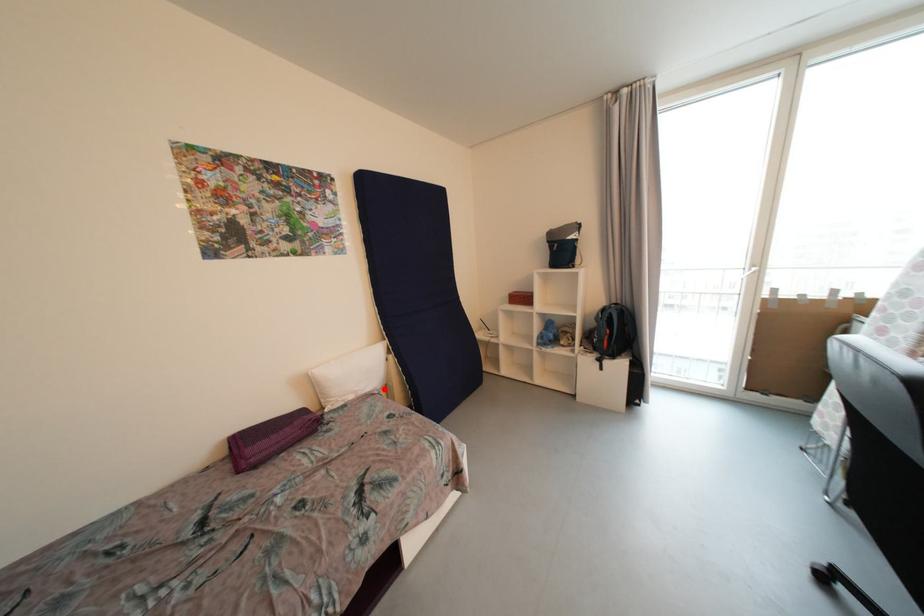
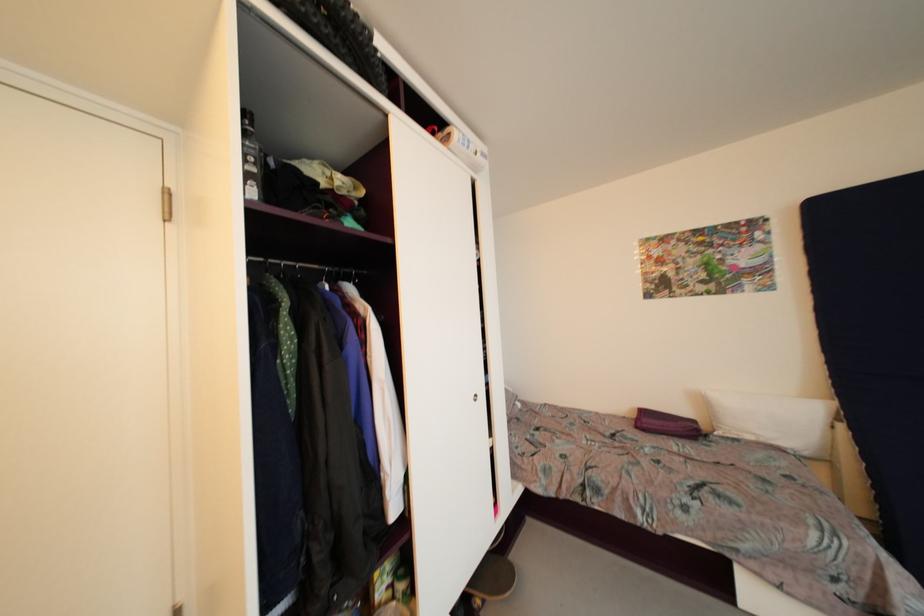
Question: I am providing you with two images of the same scene from different viewpoints. A red point is shown in image1. For the corresponding object point in image2, is it positioned nearer or farther from the camera?

Choices:
 (A) Nearer
 (B) Farther

Answer: (A)